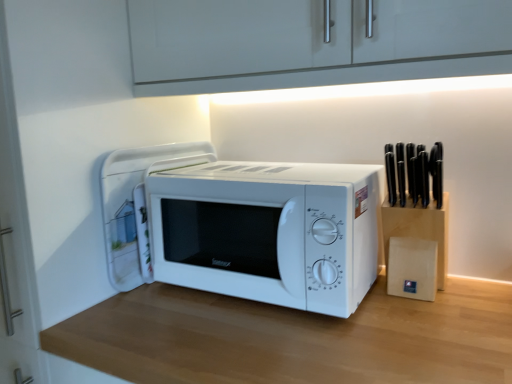
Locate an element on the screen. The height and width of the screenshot is (384, 512). free spot in front of white matte microwave at center is located at coordinates (294, 338).